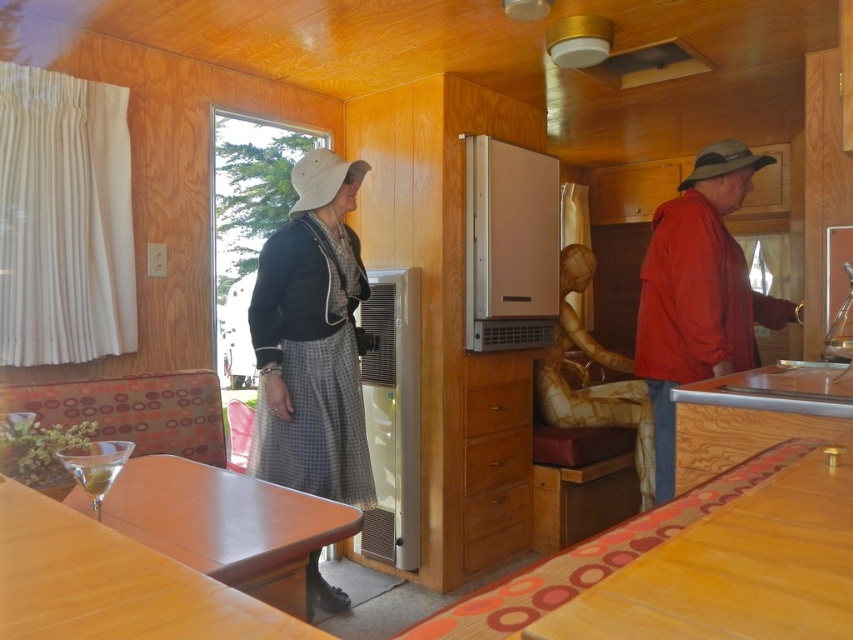
Looking at this image, you are a guest in this trailer and want to hang your black woolen jacket at center on the metallic gold exhaust hood at upper center. Is the jacket currently positioned in a way that would allow you to do so easily?

The black woolen jacket at center is in front of the metallic gold exhaust hood at upper center, so you can easily reach the exhaust hood to hang the jacket since the jacket is already positioned in front of it.

You are a waiter carrying a tray of drinks and need to place them on the table between the two clear glass martini glass at lower left. Is there enough space for you to place the tray between them?

The two clear glass martini glass at lower left are 1.14 meters apart, so there is enough space to place the tray between them.

You are organizing a small gathering in the vintage trailer and need to place the black woolen jacket at center and the red matte jacket at right on a narrow shelf. Which jacket should you choose to ensure it fits on the shelf if the shelf can only accommodate the narrower item?

The black woolen jacket at center has a lesser width compared to the red matte jacket at right, so you should choose the black woolen jacket at center to ensure it fits on the narrow shelf.